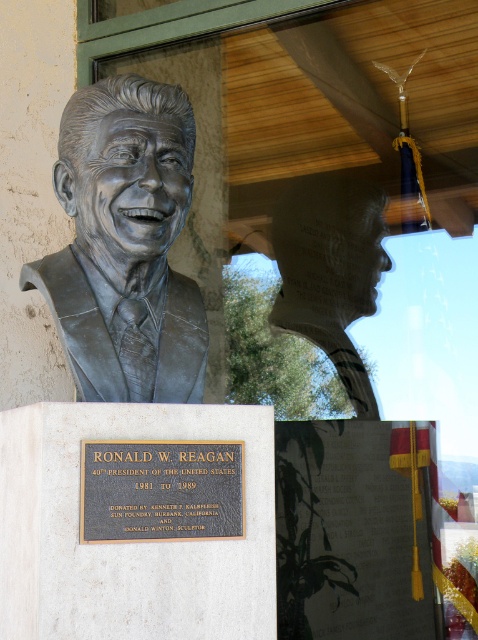
Who is positioned more to the left, bronze bust at center or bronze plaque at center?

Positioned to the left is bronze plaque at center.

Measure the distance from bronze bust at center to bronze plaque at center.

They are 1.82 meters apart.

The image size is (478, 640). What do you see at coordinates (330, 269) in the screenshot?
I see `bronze bust at center` at bounding box center [330, 269].

Identify the location of bronze bust at center. Image resolution: width=478 pixels, height=640 pixels. (330, 269).

Is bronze statue at center bigger than bronze bust at center?

Incorrect, bronze statue at center is not larger than bronze bust at center.

Which of these two, bronze statue at center or bronze bust at center, stands shorter?

bronze statue at center

Identify the location of bronze statue at center. (126, 244).

Does bronze statue at center have a lesser height compared to bronze plaque at center?

No, bronze statue at center is not shorter than bronze plaque at center.

You are a GUI agent. You are given a task and a screenshot of the screen. Output one action in this format:
    pyautogui.click(x=<x>, y=<y>)
    Task: Click on the bronze statue at center
    The height and width of the screenshot is (640, 478).
    Given the screenshot: What is the action you would take?
    pyautogui.click(x=126, y=244)